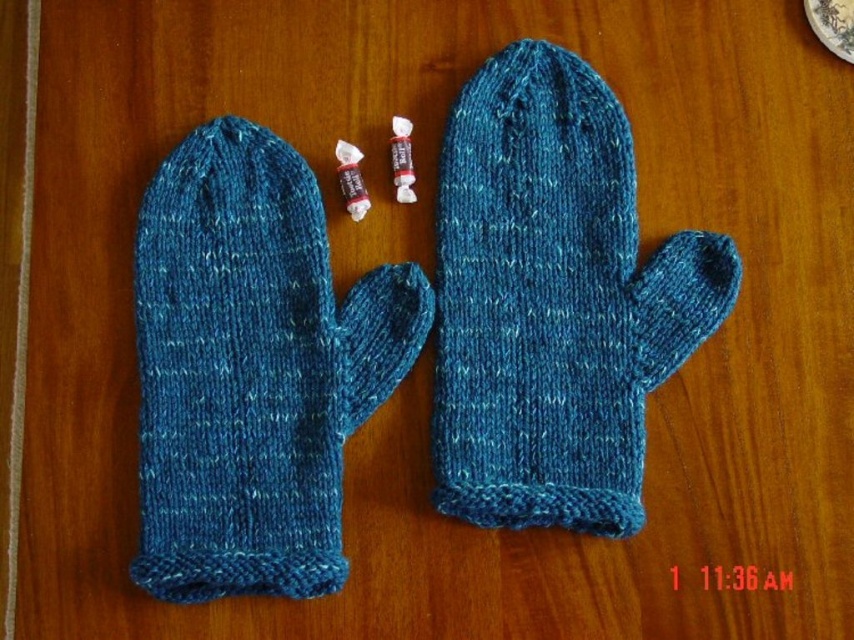
Question: Does teal knitted mitten at center appear on the left side of blue knitted mitten at left?

Choices:
 (A) yes
 (B) no

Answer: (B)

Question: Can you confirm if teal knitted mitten at center is positioned above blue knitted mitten at left?

Choices:
 (A) no
 (B) yes

Answer: (B)

Question: Is teal knitted mitten at center smaller than blue knitted mitten at left?

Choices:
 (A) no
 (B) yes

Answer: (B)

Question: Which of the following is the farthest from the observer?

Choices:
 (A) blue knitted mitten at left
 (B) teal knitted mitten at center

Answer: (B)